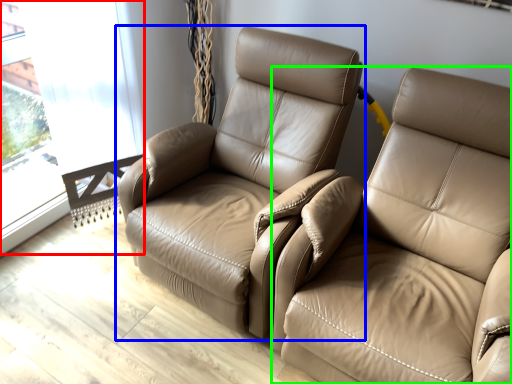
Question: Which is nearer to the window (highlighted by a red box)? chair (highlighted by a blue box) or studio couch (highlighted by a green box).

Choices:
 (A) chair
 (B) studio couch

Answer: (A)